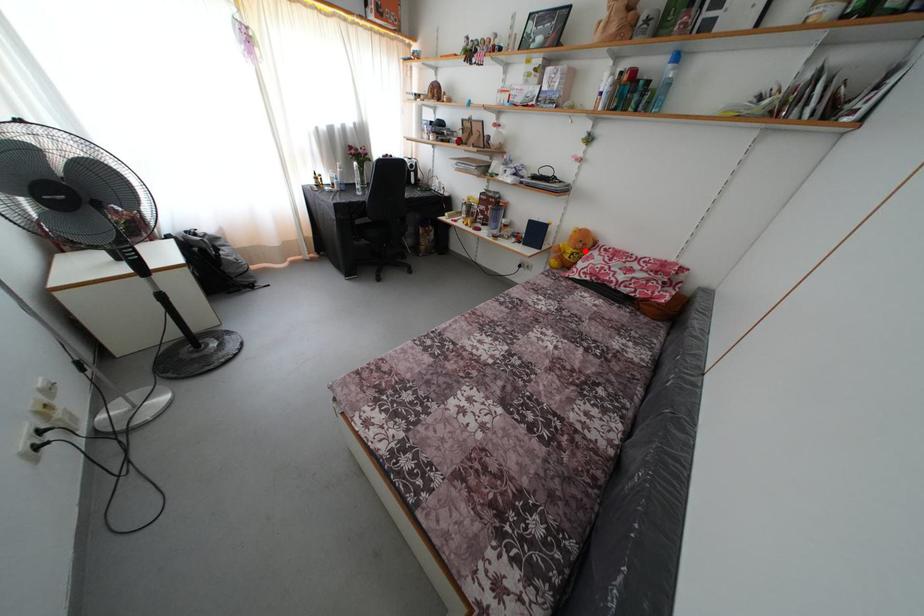
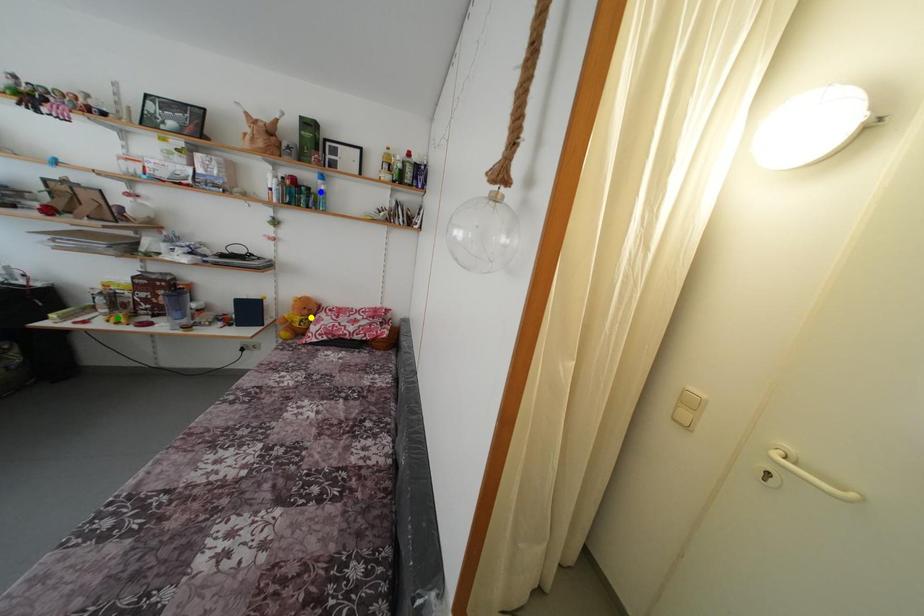
Question: I am providing you with two images of the same scene from different viewpoints. A red point is marked on the first image. You are given multiple points on the second image. In image 2, which mark is for the same physical point as the one in image 1?

Choices:
 (A) blue point
 (B) green point
 (C) yellow point

Answer: (C)